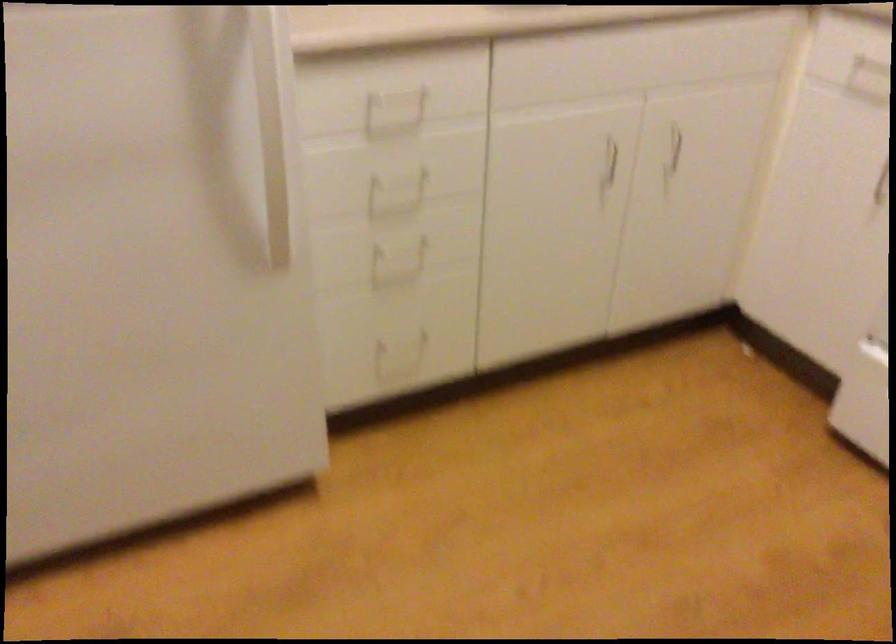
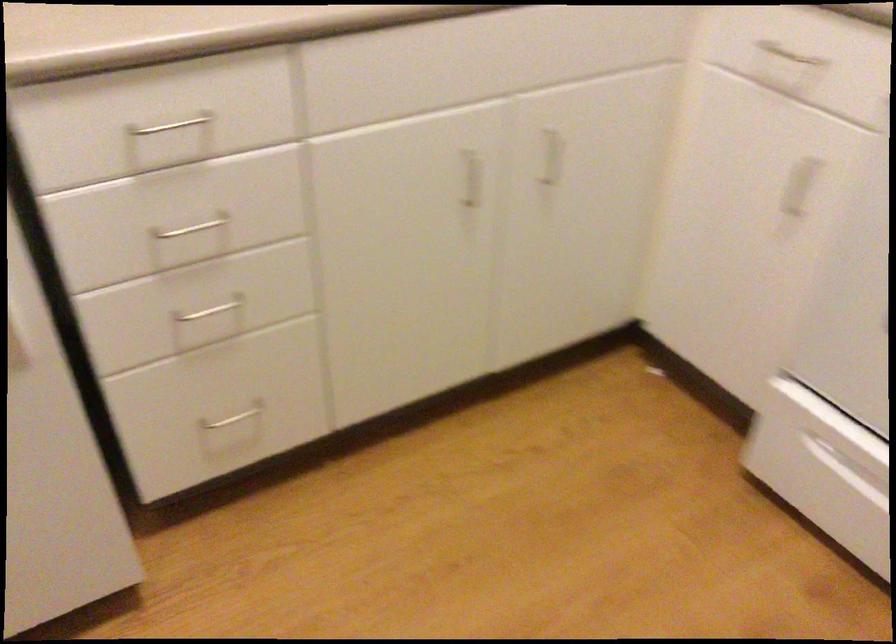
Where in the second image is the point corresponding to [607,156] from the first image?

(471, 178)